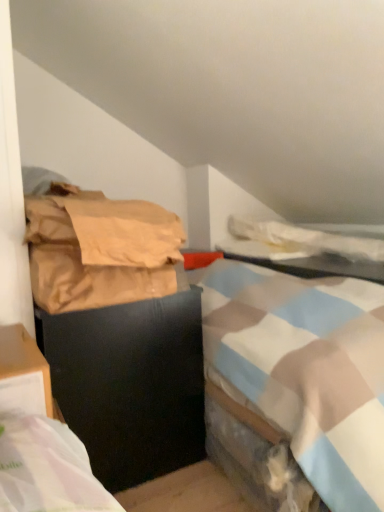
Question: Is point (168, 292) closer or farther from the camera than point (87, 338)?

Choices:
 (A) farther
 (B) closer

Answer: (A)

Question: Considering the positions of brown paper bag at left and black matte trash can at left in the image, is brown paper bag at left wider or thinner than black matte trash can at left?

Choices:
 (A) thin
 (B) wide

Answer: (A)

Question: Estimate the real-world distances between objects in this image. Which object is closer to the matte plastic table at center?

Choices:
 (A) brown paper bag at left
 (B) white soft blanket at upper right
 (C) black matte trash can at left

Answer: (B)

Question: Which of these objects is positioned farthest from the brown paper bag at left?

Choices:
 (A) black matte trash can at left
 (B) white soft blanket at upper right
 (C) matte plastic table at center

Answer: (B)